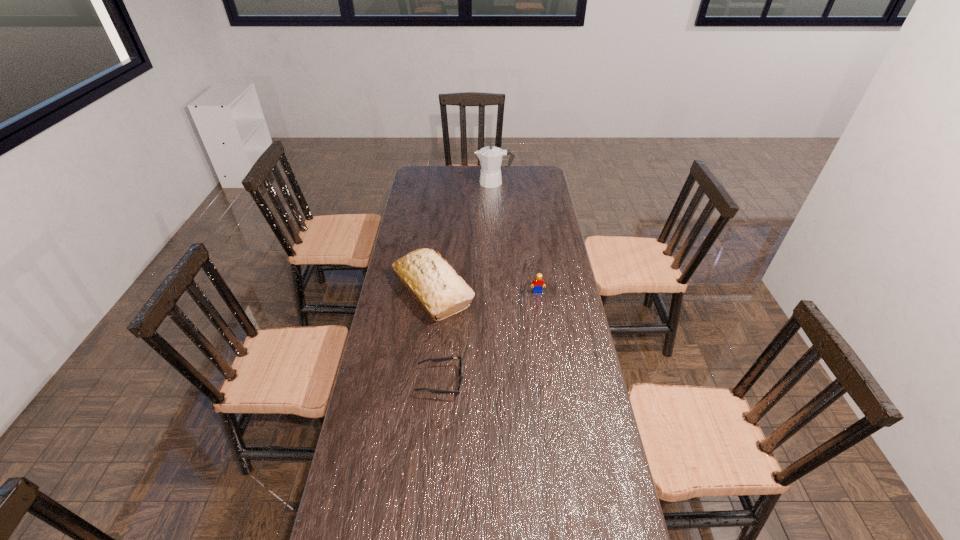
Identify the location of vacant space situated 0.300m on the back of the bread. This screenshot has height=540, width=960. (441, 219).

At what (x,y) coordinates should I click in order to perform the action: click on vacant region located 0.060m on the front-facing side of the third tallest object. Please return your answer as a coordinate pair (x, y). The image size is (960, 540). Looking at the image, I should click on (540, 305).

You are a GUI agent. You are given a task and a screenshot of the screen. Output one action in this format:
    pyautogui.click(x=<x>, y=<y>)
    Task: Click on the blank space located 0.390m on the front-facing side of the nearest object
    
    Given the screenshot: What is the action you would take?
    pyautogui.click(x=585, y=381)

Locate an element on the screen. This screenshot has height=540, width=960. object located in the far edge section of the desktop is located at coordinates (490, 157).

At what (x,y) coordinates should I click in order to perform the action: click on object that is at the left edge. Please return your answer as a coordinate pair (x, y). This screenshot has height=540, width=960. Looking at the image, I should click on (433, 282).

This screenshot has width=960, height=540. What are the coordinates of `object located in the right edge section of the desktop` in the screenshot? It's located at (538, 282).

I want to click on free space at the far edge of the desktop, so click(x=500, y=187).

The image size is (960, 540). I want to click on vacant space at the left edge of the desktop, so click(x=412, y=399).

Find the location of a particular element. vacant space at the right edge of the desktop is located at coordinates (540, 324).

Locate an element on the screen. free region at the far left corner is located at coordinates (438, 187).